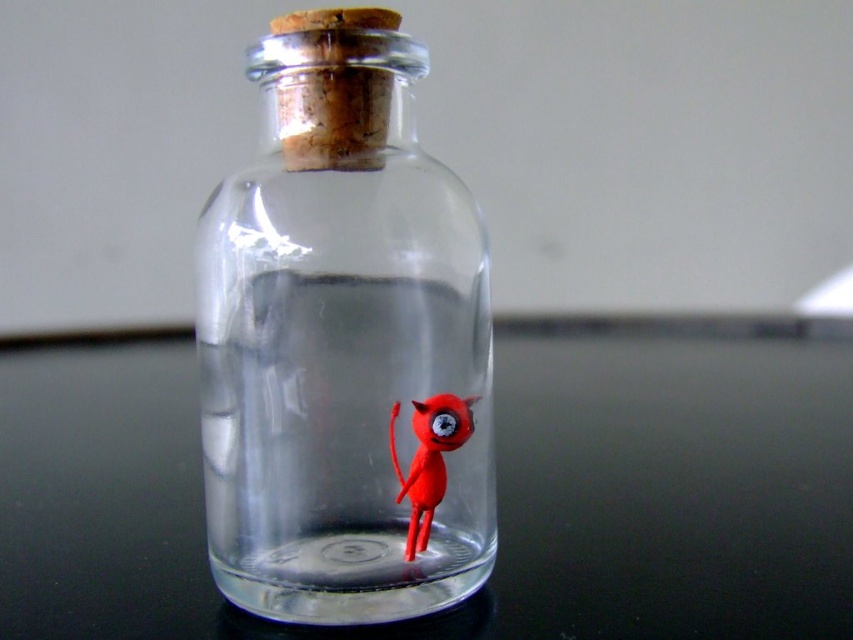
From the picture: Which is more to the left, black glass table at center or rubber matte toy at center?

From the viewer's perspective, rubber matte toy at center appears more on the left side.

Who is more distant from viewer, (65, 522) or (421, 429)?

Point (65, 522)

Identify the location of black glass table at center. This screenshot has width=853, height=640. (497, 484).

Based on the photo, is transparent glass bottle at center positioned at the back of rubber matte toy at center?

No, transparent glass bottle at center is closer to the viewer.

Is transparent glass bottle at center above rubber matte toy at center?

Yes, transparent glass bottle at center is above rubber matte toy at center.

Where is `transparent glass bottle at center`? This screenshot has width=853, height=640. transparent glass bottle at center is located at coordinates (344, 342).

From the picture: Can you confirm if black glass table at center is positioned to the right of transparent glass bottle at center?

Yes, black glass table at center is to the right of transparent glass bottle at center.

Is black glass table at center bigger than transparent glass bottle at center?

Yes, black glass table at center is bigger than transparent glass bottle at center.

Is point (122, 589) positioned behind point (213, 541)?

Yes, it is behind point (213, 541).

The width and height of the screenshot is (853, 640). I want to click on black glass table at center, so click(x=497, y=484).